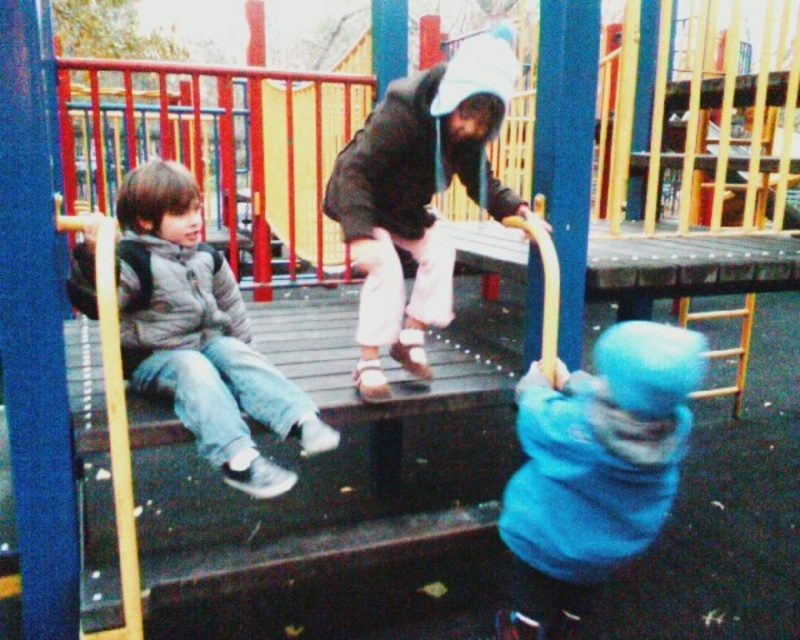
You are a parent supervising children at the playground. You notice two children wearing the blue fuzzy hat at lower right and the gray fuzzy jacket at left. Which child is positioned more to the east if the sun is setting in the west?

The blue fuzzy hat at lower right is positioned more to the east because it is to the right of the gray fuzzy jacket at left, and since the sun is setting in the west, the right side of the image faces east.

You are a parent at the playground looking for your child. You remember your child was wearing a blue fuzzy hat at lower right and a gray fuzzy jacket at left. Based on the scene description, can you determine which clothing item is closer to the ground?

The blue fuzzy hat at lower right is located below gray fuzzy jacket at left, so the blue fuzzy hat at lower right is closer to the ground.